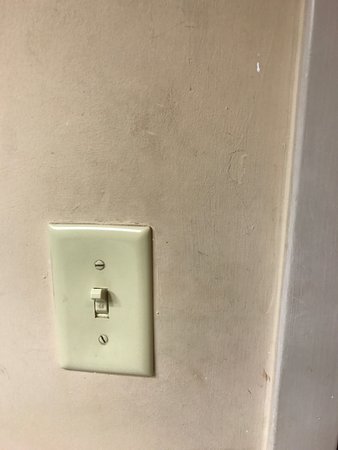
This screenshot has height=450, width=338. What are the coordinates of `stain` in the screenshot? It's located at (255, 376).